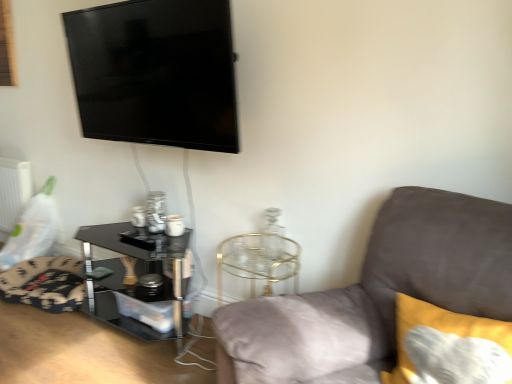
Question: Does black glossy tv at upper left turn towards suede gray couch at right?

Choices:
 (A) no
 (B) yes

Answer: (A)

Question: Is black glossy tv at upper left wider than suede gray couch at right?

Choices:
 (A) no
 (B) yes

Answer: (A)

Question: Can you confirm if black glossy tv at upper left is thinner than suede gray couch at right?

Choices:
 (A) yes
 (B) no

Answer: (A)

Question: From a real-world perspective, is black glossy tv at upper left on top of suede gray couch at right?

Choices:
 (A) no
 (B) yes

Answer: (B)

Question: Would you say black glossy tv at upper left is a long distance from suede gray couch at right?

Choices:
 (A) no
 (B) yes

Answer: (B)

Question: Are black glossy tv at upper left and suede gray couch at right beside each other?

Choices:
 (A) no
 (B) yes

Answer: (A)

Question: From the image's perspective, is soft yellow cushion at right under suede gray couch at right?

Choices:
 (A) yes
 (B) no

Answer: (B)

Question: Does soft yellow cushion at right appear on the right side of suede gray couch at right?

Choices:
 (A) yes
 (B) no

Answer: (A)

Question: Is suede gray couch at right surrounded by soft yellow cushion at right?

Choices:
 (A) no
 (B) yes

Answer: (A)

Question: Considering the relative sizes of soft yellow cushion at right and suede gray couch at right in the image provided, is soft yellow cushion at right shorter than suede gray couch at right?

Choices:
 (A) no
 (B) yes

Answer: (B)

Question: Is soft yellow cushion at right not close to suede gray couch at right?

Choices:
 (A) yes
 (B) no

Answer: (B)

Question: Considering the relative sizes of soft yellow cushion at right and suede gray couch at right in the image provided, is soft yellow cushion at right bigger than suede gray couch at right?

Choices:
 (A) yes
 (B) no

Answer: (B)

Question: Does suede gray couch at right touch white matte radiator at left?

Choices:
 (A) yes
 (B) no

Answer: (B)